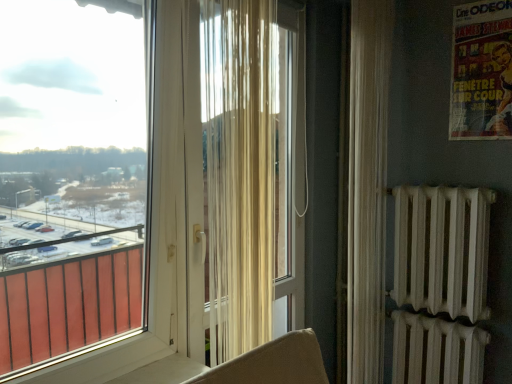
Describe the element at coordinates (240, 171) in the screenshot. The height and width of the screenshot is (384, 512). I see `sheer white curtain at center, acting as the first curtain starting from the left` at that location.

Image resolution: width=512 pixels, height=384 pixels. Find the location of `transparent plastic window at upper left`. transparent plastic window at upper left is located at coordinates (72, 177).

Where is `matte paper poster at upper right`? matte paper poster at upper right is located at coordinates (481, 71).

From the picture: Is sheer white curtain at center, the second curtain from the right, positioned far away from sheer white curtain at right, the 1th curtain positioned from the right?

No, sheer white curtain at center, the second curtain from the right, is not far from sheer white curtain at right, the 1th curtain positioned from the right.

From the image's perspective, which object appears higher, sheer white curtain at center, marked as the second curtain in a back-to-front arrangement, or sheer white curtain at right, which is the 1th curtain in back-to-front order?

sheer white curtain at center, marked as the second curtain in a back-to-front arrangement, appears higher in the image.

Which is less distant, (216,133) or (354,124)?

Point (216,133) appears to be closer to the viewer than point (354,124).

Can you tell me how much sheer white curtain at center, acting as the first curtain starting from the left, and sheer white curtain at right, which ranks as the 2th curtain in front-to-back order, differ in facing direction?

They differ by 0.00409 degrees in their facing directions.

Which object is positioned more to the left, sheer white curtain at right, the 1th curtain positioned from the right, or matte paper poster at upper right?

sheer white curtain at right, the 1th curtain positioned from the right.

Who is bigger, sheer white curtain at right, the 1th curtain positioned from the right, or matte paper poster at upper right?

sheer white curtain at right, the 1th curtain positioned from the right.

Is sheer white curtain at right, which is the 1th curtain in back-to-front order, outside of matte paper poster at upper right?

sheer white curtain at right, which is the 1th curtain in back-to-front order, is positioned outside matte paper poster at upper right.

From the image's perspective, which is below, sheer white curtain at right, which ranks as the 2th curtain in front-to-back order, or matte paper poster at upper right?

From the image's view, sheer white curtain at right, which ranks as the 2th curtain in front-to-back order, is below.

Looking at the image, does transparent plastic window at upper left seem bigger or smaller compared to sheer white curtain at center, the second curtain from the right?

Considering their sizes, transparent plastic window at upper left takes up more space than sheer white curtain at center, the second curtain from the right.

Who is taller, transparent plastic window at upper left or sheer white curtain at center, the second curtain from the right?

transparent plastic window at upper left.

From the image's perspective, is transparent plastic window at upper left above or below sheer white curtain at center, the second curtain from the right?

Based on their image positions, transparent plastic window at upper left is located beneath sheer white curtain at center, the second curtain from the right.

Would you say transparent plastic window at upper left contains sheer white curtain at center, marked as the second curtain in a back-to-front arrangement?

Actually, sheer white curtain at center, marked as the second curtain in a back-to-front arrangement, is outside transparent plastic window at upper left.

Is matte paper poster at upper right in contact with transparent plastic window at upper left?

No, matte paper poster at upper right is not beside transparent plastic window at upper left.

Is matte paper poster at upper right thinner than transparent plastic window at upper left?

Indeed, matte paper poster at upper right has a lesser width compared to transparent plastic window at upper left.

Is matte paper poster at upper right at the right side of transparent plastic window at upper left?

Yes.

Considering the relative sizes of matte paper poster at upper right and transparent plastic window at upper left in the image provided, is matte paper poster at upper right taller than transparent plastic window at upper left?

No.

Which object is positioned more to the left, transparent plastic window at upper left or sheer white curtain at right, the 1th curtain positioned from the right?

From the viewer's perspective, transparent plastic window at upper left appears more on the left side.

Which is closer, (21, 77) or (358, 37)?

Point (21, 77) is closer to the camera than point (358, 37).

Is transparent plastic window at upper left far from sheer white curtain at right, the 1th curtain positioned from the right?

Indeed, transparent plastic window at upper left is not near sheer white curtain at right, the 1th curtain positioned from the right.

Is transparent plastic window at upper left oriented towards sheer white curtain at right, which is the 1th curtain in back-to-front order?

No, transparent plastic window at upper left is not oriented towards sheer white curtain at right, which is the 1th curtain in back-to-front order.

Is sheer white curtain at center, acting as the first curtain starting from the left, outside of transparent plastic window at upper left?

Indeed, sheer white curtain at center, acting as the first curtain starting from the left, is completely outside transparent plastic window at upper left.

Is the position of sheer white curtain at center, the first curtain from the front, less distant than that of transparent plastic window at upper left?

No, it is not.

Considering the relative sizes of sheer white curtain at center, acting as the first curtain starting from the left, and transparent plastic window at upper left in the image provided, is sheer white curtain at center, acting as the first curtain starting from the left, shorter than transparent plastic window at upper left?

Correct, sheer white curtain at center, acting as the first curtain starting from the left, is not as tall as transparent plastic window at upper left.

Locate an element on the screen. curtain above the transparent plastic window at upper left (from the image's perspective) is located at coordinates (240, 171).

Can you tell me how much sheer white curtain at right, the 1th curtain positioned from the right, and transparent plastic window at upper left differ in facing direction?

They differ by 0.566 degrees in their facing directions.

Which object is positioned more to the left, sheer white curtain at right, which appears as the second curtain when viewed from the left, or transparent plastic window at upper left?

transparent plastic window at upper left.

Is sheer white curtain at right, which ranks as the 2th curtain in front-to-back order, not close to transparent plastic window at upper left?

Yes.

Looking at this image, how far apart are sheer white curtain at right, which is the 1th curtain in back-to-front order, and transparent plastic window at upper left?

They are 3.70 feet apart.

At what (x,y) coordinates should I click in order to perform the action: click on curtain above the sheer white curtain at right, which ranks as the 2th curtain in front-to-back order (from a real-world perspective). Please return your answer as a coordinate pair (x, y). Looking at the image, I should click on (240, 171).

At what (x,y) coordinates should I click in order to perform the action: click on poster page on the right of sheer white curtain at right, the 1th curtain positioned from the right. Please return your answer as a coordinate pair (x, y). Looking at the image, I should click on (481, 71).

Which object lies further to the anchor point transparent plastic window at upper left, matte paper poster at upper right or sheer white curtain at right, the 1th curtain positioned from the right?

The object further to transparent plastic window at upper left is matte paper poster at upper right.

Which object lies nearer to the anchor point sheer white curtain at center, marked as the second curtain in a back-to-front arrangement, transparent plastic window at upper left or matte paper poster at upper right?

transparent plastic window at upper left is positioned closer to the anchor sheer white curtain at center, marked as the second curtain in a back-to-front arrangement.

Which object lies nearer to the anchor point sheer white curtain at center, the first curtain from the front, transparent plastic window at upper left or sheer white curtain at right, the 1th curtain positioned from the right?

Based on the image, transparent plastic window at upper left appears to be nearer to sheer white curtain at center, the first curtain from the front.

When comparing their distances from matte paper poster at upper right, does transparent plastic window at upper left or sheer white curtain at center, marked as the second curtain in a back-to-front arrangement, seem closer?

sheer white curtain at center, marked as the second curtain in a back-to-front arrangement, is positioned closer to the anchor matte paper poster at upper right.

Looking at the image, which one is located further to transparent plastic window at upper left, matte paper poster at upper right or sheer white curtain at center, the second curtain from the right?

matte paper poster at upper right is further to transparent plastic window at upper left.

Looking at the image, which one is located closer to matte paper poster at upper right, sheer white curtain at right, the 1th curtain positioned from the right, or sheer white curtain at center, marked as the second curtain in a back-to-front arrangement?

sheer white curtain at right, the 1th curtain positioned from the right, is closer to matte paper poster at upper right.

Looking at the image, which one is located closer to sheer white curtain at right, which is the 1th curtain in back-to-front order, matte paper poster at upper right or sheer white curtain at center, marked as the second curtain in a back-to-front arrangement?

Among the two, matte paper poster at upper right is located nearer to sheer white curtain at right, which is the 1th curtain in back-to-front order.

Estimate the real-world distances between objects in this image. Which object is closer to transparent plastic window at upper left, sheer white curtain at right, the 1th curtain positioned from the right, or matte paper poster at upper right?

sheer white curtain at right, the 1th curtain positioned from the right, lies closer to transparent plastic window at upper left than the other object.

At what (x,y) coordinates should I click in order to perform the action: click on curtain between sheer white curtain at center, marked as the second curtain in a back-to-front arrangement, and matte paper poster at upper right. Please return your answer as a coordinate pair (x, y). Looking at the image, I should click on (367, 187).

You are a GUI agent. You are given a task and a screenshot of the screen. Output one action in this format:
    pyautogui.click(x=<x>, y=<y>)
    Task: Click on the curtain between transparent plastic window at upper left and sheer white curtain at right, the 1th curtain positioned from the right, in the horizontal direction
    
    Given the screenshot: What is the action you would take?
    pyautogui.click(x=240, y=171)